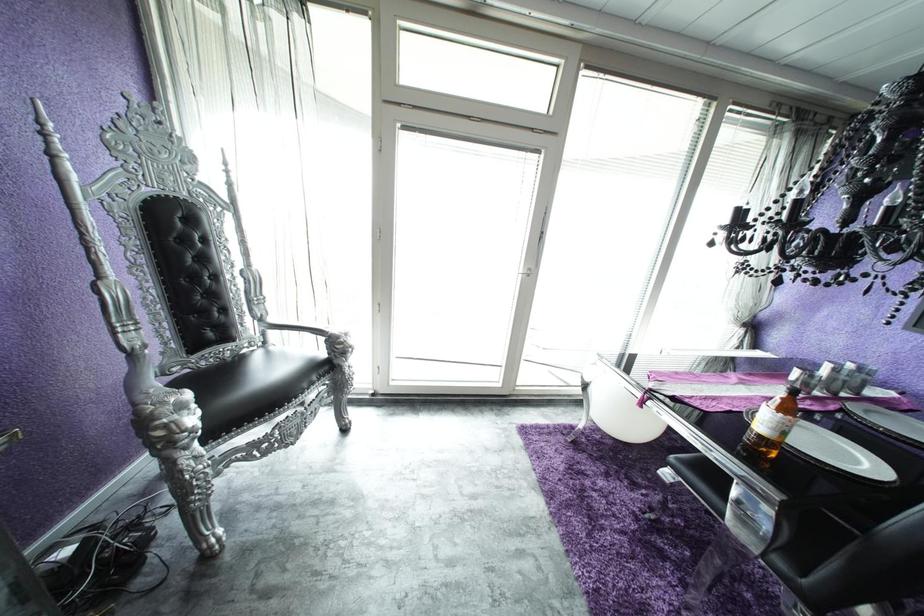
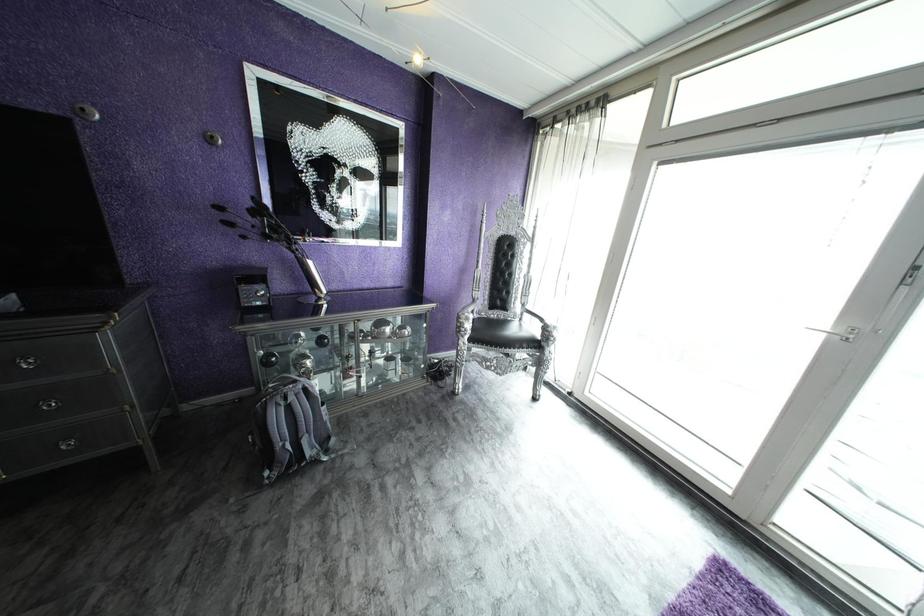
Question: How did the camera likely rotate?

Choices:
 (A) Left
 (B) Right
 (C) Up
 (D) Down

Answer: (A)